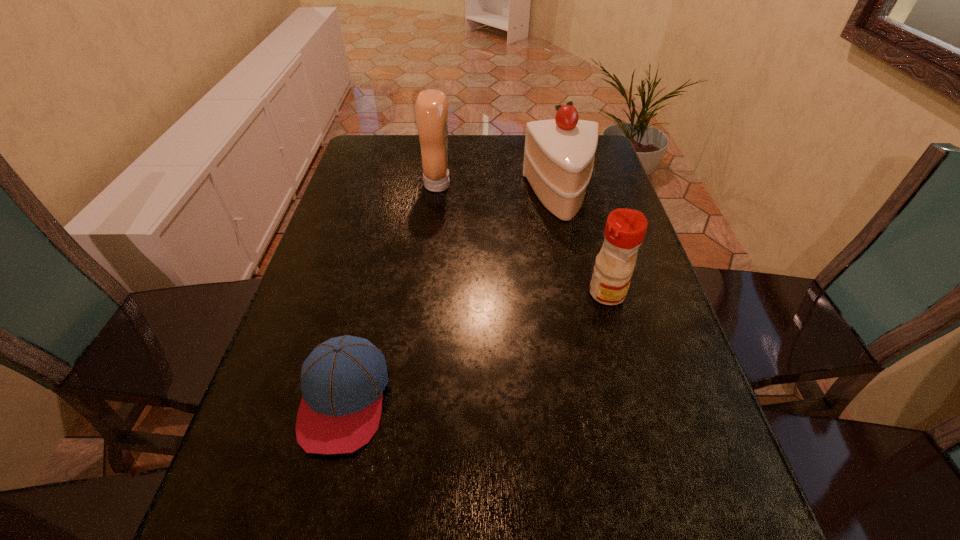
Locate which object is the closest to the taller condiment. Please provide its 2D coordinates. Your answer should be formatted as a tuple, i.e. [(x, y)], where the tuple contains the x and y coordinates of a point satisfying the conditions above.

[(559, 153)]

In order to click on free space that satisfies the following two spatial constraints: 1. on the back side of the shorter condiment; 2. on the label of the farther condiment in this screenshot , I will do `click(577, 185)`.

I want to click on free location that satisfies the following two spatial constraints: 1. on the label of the cake; 2. on the right side of the second object from left to right, so click(436, 197).

Find the location of a particular element. The height and width of the screenshot is (540, 960). vacant region that satisfies the following two spatial constraints: 1. on the label of the second object from left to right; 2. on the right side of the cake is located at coordinates (436, 197).

The height and width of the screenshot is (540, 960). Identify the location of free space in the image that satisfies the following two spatial constraints: 1. on the label of the second object from left to right; 2. on the left side of the cake. (436, 197).